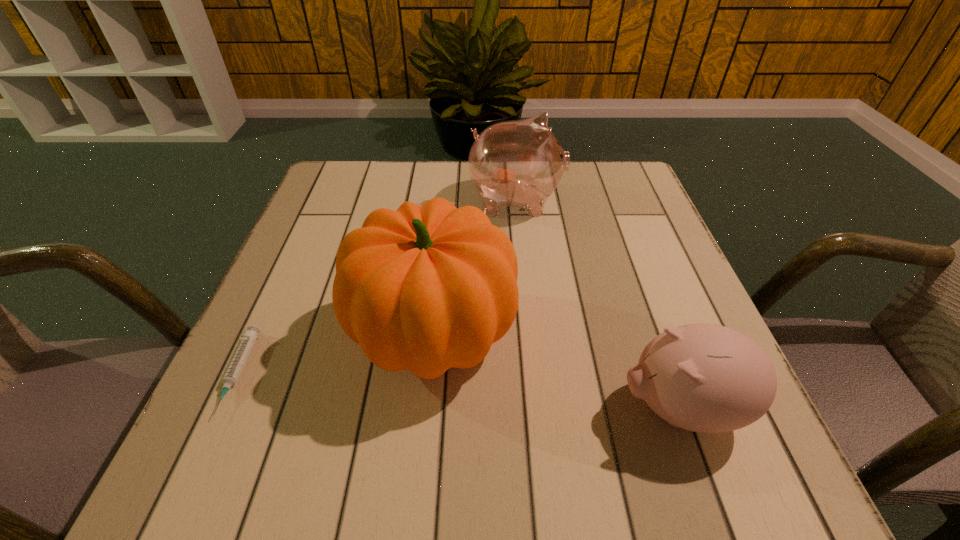
Where is `vacant space located 0.160m at the snout of the nearer piggy bank`? The width and height of the screenshot is (960, 540). vacant space located 0.160m at the snout of the nearer piggy bank is located at coordinates (515, 408).

Image resolution: width=960 pixels, height=540 pixels. I want to click on vacant region located at the snout of the nearer piggy bank, so click(x=579, y=408).

This screenshot has height=540, width=960. I want to click on object at the far edge, so click(x=519, y=163).

I want to click on object that is positioned at the near edge, so click(707, 378).

Image resolution: width=960 pixels, height=540 pixels. In order to click on object that is at the left edge in this screenshot , I will do `click(234, 370)`.

Identify the location of object present at the right edge. 707,378.

Find the location of a particular element. Image resolution: width=960 pixels, height=540 pixels. object situated at the near right corner is located at coordinates (707, 378).

Identify the location of vacant area at the far edge of the desktop. (568, 191).

Where is `vacant region at the near edge of the desktop`? Image resolution: width=960 pixels, height=540 pixels. vacant region at the near edge of the desktop is located at coordinates (394, 464).

Identify the location of vacant space at the left edge of the desktop. Image resolution: width=960 pixels, height=540 pixels. (299, 268).